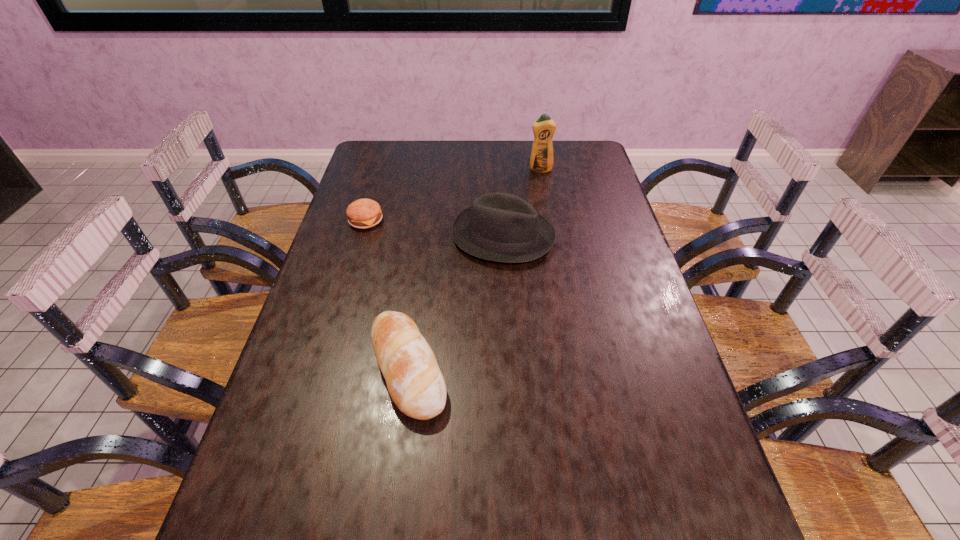
Find the location of a particular element. Image resolution: width=960 pixels, height=540 pixels. the farthest object is located at coordinates (541, 160).

Locate an element on the screen. This screenshot has width=960, height=540. detergent is located at coordinates (541, 160).

The height and width of the screenshot is (540, 960). In order to click on fedora in this screenshot , I will do `click(500, 227)`.

Find the location of a particular element. This screenshot has width=960, height=540. bread is located at coordinates (415, 383).

What are the coordinates of `the nearest object` in the screenshot? It's located at (415, 383).

The width and height of the screenshot is (960, 540). I want to click on hamburger, so click(x=364, y=213).

Where is `the leftmost object`? the leftmost object is located at coordinates (364, 213).

Find the location of a particular element. vacant space located on the label of the farthest object is located at coordinates (552, 237).

Identify the location of vacant region located 0.150m on the left of the fedora. (403, 236).

Find the location of a particular element. free spot located 0.200m on the back of the second shortest object is located at coordinates (421, 266).